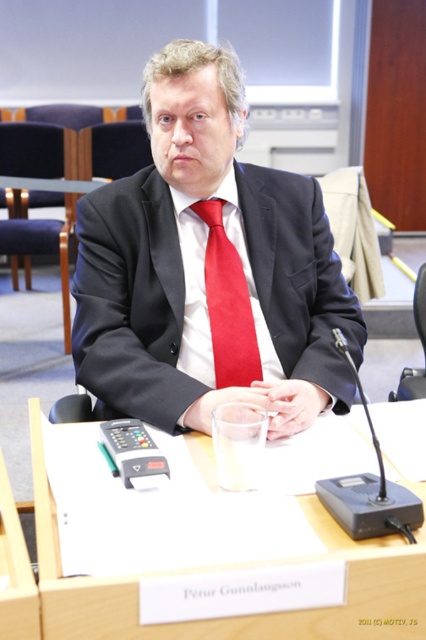
Question: Which point is closer to the camera?

Choices:
 (A) (86, 579)
 (B) (5, 179)
 (C) (420, 310)
 (D) (207, 257)

Answer: (A)

Question: Which point is closer to the camera?

Choices:
 (A) red satin tie at center
 (B) black leather chair at center

Answer: (A)

Question: Considering the relative positions of white paper at center and black leather chair at center in the image provided, where is white paper at center located with respect to black leather chair at center?

Choices:
 (A) left
 (B) right

Answer: (A)

Question: Among these points, which one is nearest to the camera?

Choices:
 (A) tap(43, 184)
 (B) tap(178, 49)
 (C) tap(348, 579)

Answer: (C)

Question: Does red satin tie at center have a greater width compared to clear glass table at center?

Choices:
 (A) yes
 (B) no

Answer: (B)

Question: Does matte black suit at center appear under black leather chair at center?

Choices:
 (A) yes
 (B) no

Answer: (B)